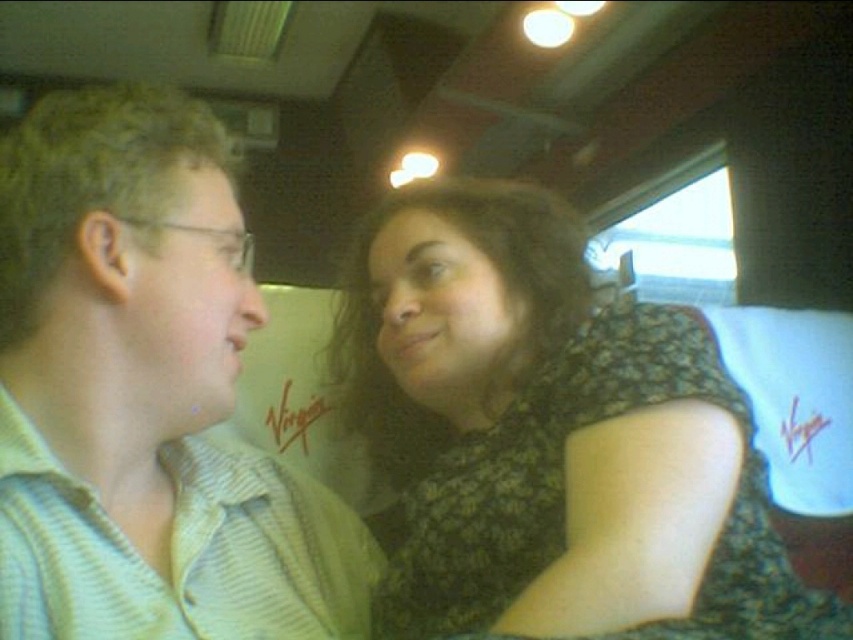
Between black lace dress at center and striped cotton shirt at left, which one appears on the left side from the viewer's perspective?

From the viewer's perspective, striped cotton shirt at left appears more on the left side.

Who is positioned more to the right, black lace dress at center or striped cotton shirt at left?

Positioned to the right is black lace dress at center.

Image resolution: width=853 pixels, height=640 pixels. Find the location of `black lace dress at center`. black lace dress at center is located at coordinates (550, 438).

Find the location of a particular element. Image resolution: width=853 pixels, height=640 pixels. black lace dress at center is located at coordinates (550, 438).